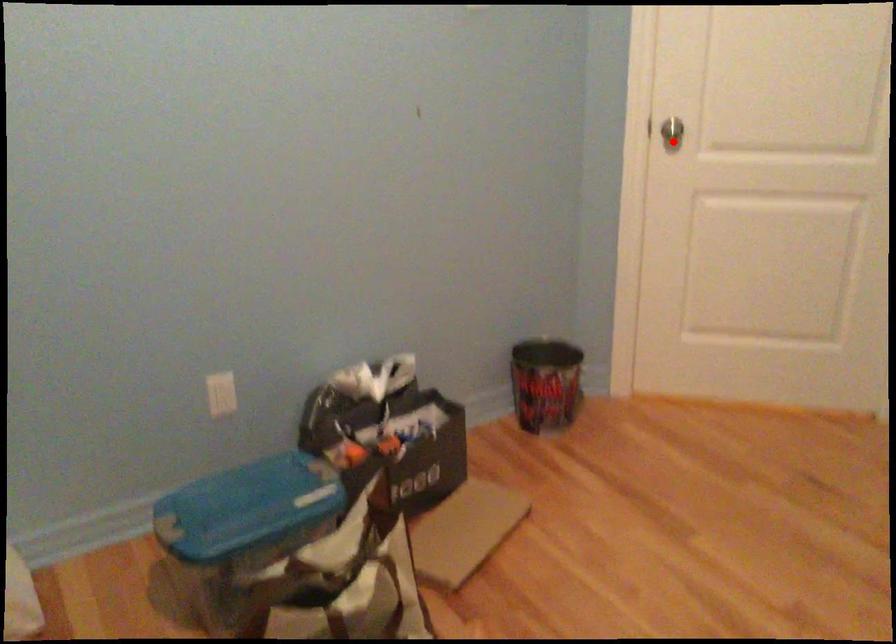
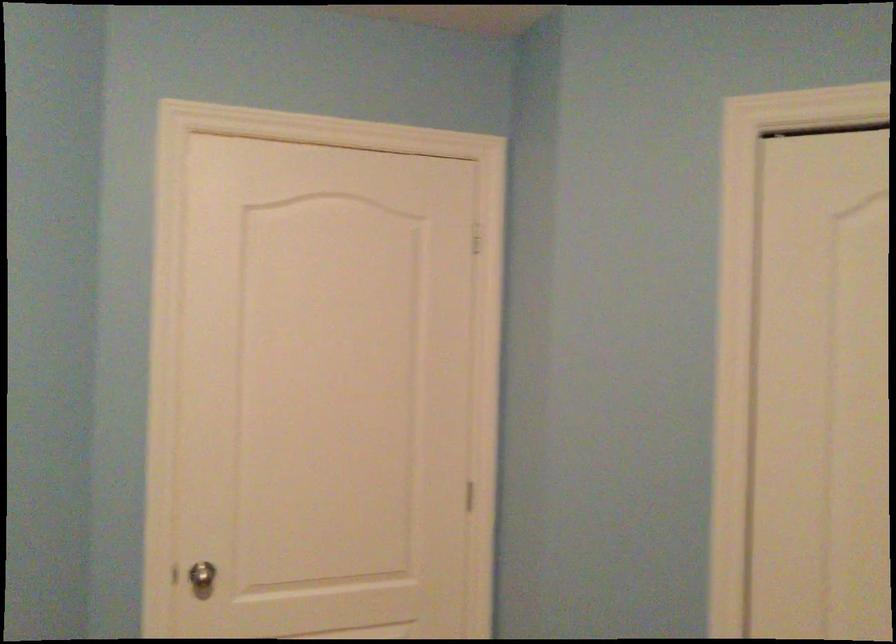
Question: A red point is marked in image1. In image2, is the corresponding 3D point closer to the camera or farther? Reply with the corresponding letter.

Choices:
 (A) The corresponding 3D point is closer.
 (B) The corresponding 3D point is farther.

Answer: (A)